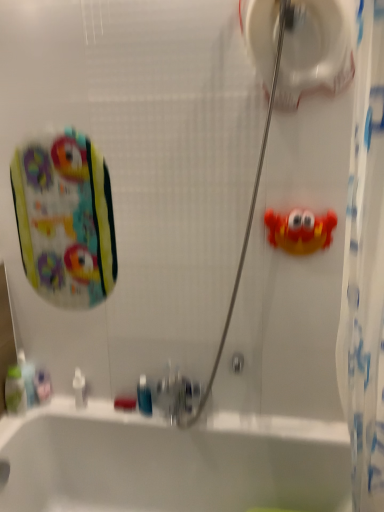
Question: Does rubber crab at right touch white glossy bathtub at lower center?

Choices:
 (A) no
 (B) yes

Answer: (A)

Question: Considering the relative sizes of rubber crab at right and white glossy bathtub at lower center in the image provided, is rubber crab at right wider than white glossy bathtub at lower center?

Choices:
 (A) yes
 (B) no

Answer: (B)

Question: Considering the relative sizes of rubber crab at right and white glossy bathtub at lower center in the image provided, is rubber crab at right thinner than white glossy bathtub at lower center?

Choices:
 (A) yes
 (B) no

Answer: (A)

Question: Does rubber crab at right contain white glossy bathtub at lower center?

Choices:
 (A) no
 (B) yes

Answer: (A)

Question: From the image's perspective, is rubber crab at right located above white glossy bathtub at lower center?

Choices:
 (A) no
 (B) yes

Answer: (B)

Question: From the image's perspective, relative to green plastic mouthwash at lower left, which is the 4th mouthwash in right-to-left order, is translucent plastic mouthwash at lower left, which is the 2th mouthwash from left to right, above or below?

Choices:
 (A) below
 (B) above

Answer: (B)

Question: Is translucent plastic mouthwash at lower left, which is the 2th mouthwash from left to right, wider or thinner than green plastic mouthwash at lower left, which is the 4th mouthwash in right-to-left order?

Choices:
 (A) thin
 (B) wide

Answer: (A)

Question: From a real-world perspective, is translucent plastic mouthwash at lower left, which is the third mouthwash from right to left, positioned above or below green plastic mouthwash at lower left, which is the 4th mouthwash in right-to-left order?

Choices:
 (A) above
 (B) below

Answer: (A)

Question: Is translucent plastic mouthwash at lower left, which is the third mouthwash from right to left, in front of or behind green plastic mouthwash at lower left, which is the first mouthwash from left to right, in the image?

Choices:
 (A) front
 (B) behind

Answer: (B)

Question: From a real-world perspective, is blue translucent mouthwash at lower center, positioned as the 1th mouthwash in right-to-left order, positioned above or below translucent plastic mouthwash at lower left, which is the 2th mouthwash from left to right?

Choices:
 (A) below
 (B) above

Answer: (A)

Question: Which is correct: blue translucent mouthwash at lower center, which is counted as the 4th mouthwash, starting from the left, is inside translucent plastic mouthwash at lower left, which is the third mouthwash from right to left, or outside of it?

Choices:
 (A) inside
 (B) outside

Answer: (B)

Question: Is blue translucent mouthwash at lower center, which is counted as the 4th mouthwash, starting from the left, wider or thinner than translucent plastic mouthwash at lower left, which is the third mouthwash from right to left?

Choices:
 (A) wide
 (B) thin

Answer: (B)

Question: From the image's perspective, is blue translucent mouthwash at lower center, positioned as the 1th mouthwash in right-to-left order, located above or below translucent plastic mouthwash at lower left, which is the third mouthwash from right to left?

Choices:
 (A) above
 (B) below

Answer: (B)

Question: In terms of size, does white plastic bottle at lower left appear bigger or smaller than translucent plastic mouthwash at lower left, which is the 2th mouthwash from left to right?

Choices:
 (A) small
 (B) big

Answer: (A)

Question: In the image, is white plastic bottle at lower left on the left side or the right side of translucent plastic mouthwash at lower left, which is the 2th mouthwash from left to right?

Choices:
 (A) left
 (B) right

Answer: (B)